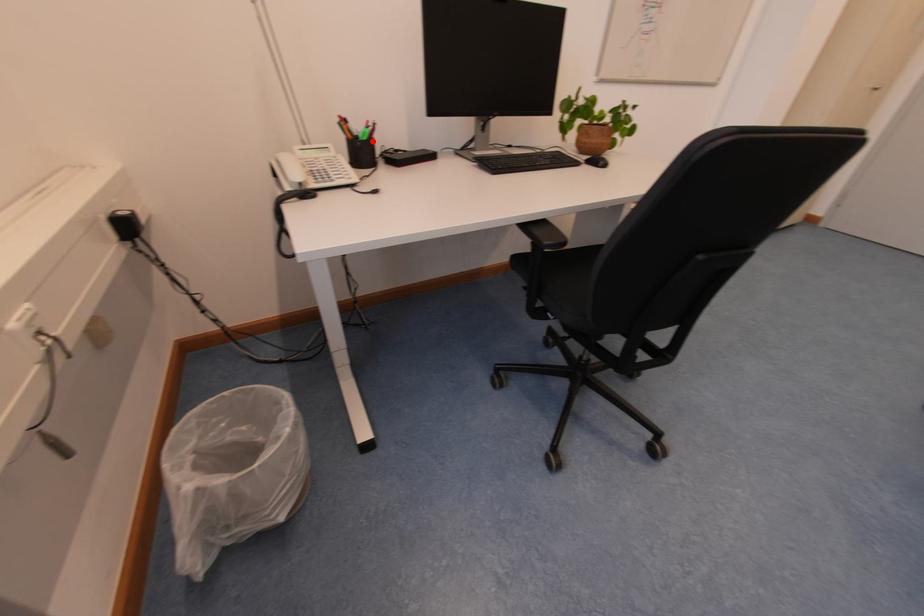
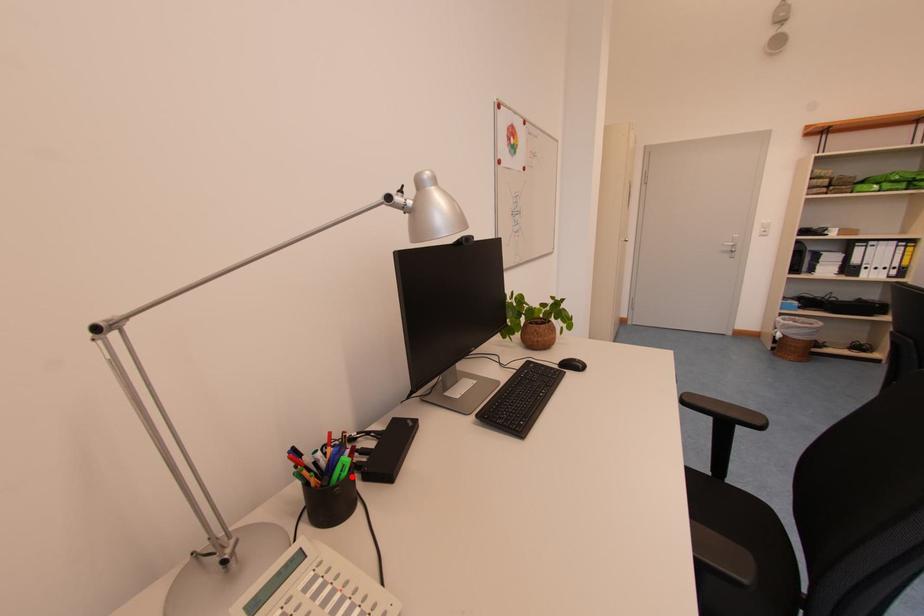
I am providing you with two images of the same scene from different viewpoints. A red point is marked on the first image and another point is marked on the second image. Do the highlighted points in image1 and image2 indicate the same real-world spot?

Yes